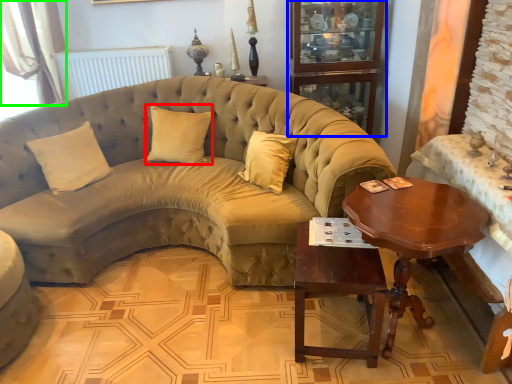
Question: Considering the real-world distances, which object is closest to pillow (highlighted by a red box)? bookshelf (highlighted by a blue box) or curtain (highlighted by a green box).

Choices:
 (A) bookshelf
 (B) curtain

Answer: (A)